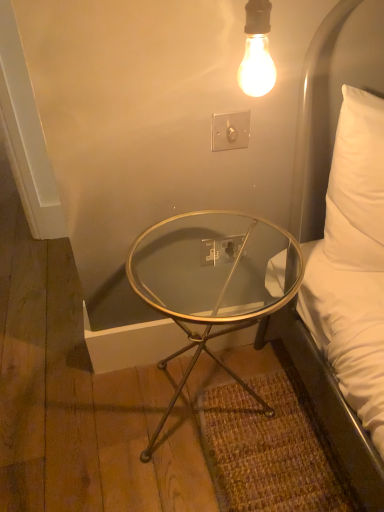
Locate an element on the screen. free spot to the left of clear glass table at lower center is located at coordinates (75, 419).